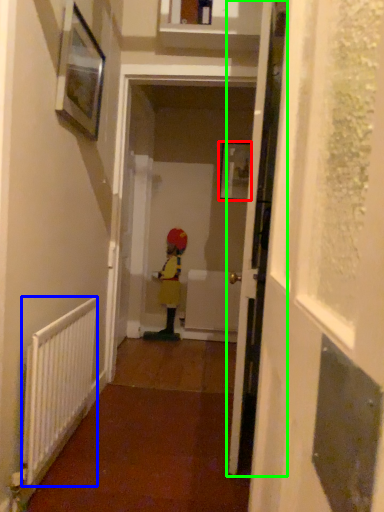
Question: Based on their relative distances, which object is farther from picture frame (highlighted by a red box)? Choose from radiator (highlighted by a blue box) and door (highlighted by a green box).

Choices:
 (A) radiator
 (B) door

Answer: (A)